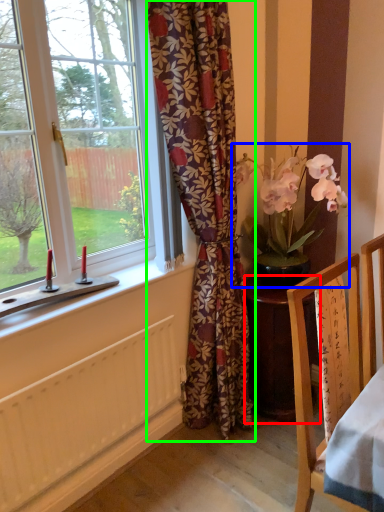
Question: Based on their relative distances, which object is nearer to desk (highlighted by a red box)? Choose from houseplant (highlighted by a blue box) and curtain (highlighted by a green box).

Choices:
 (A) houseplant
 (B) curtain

Answer: (B)